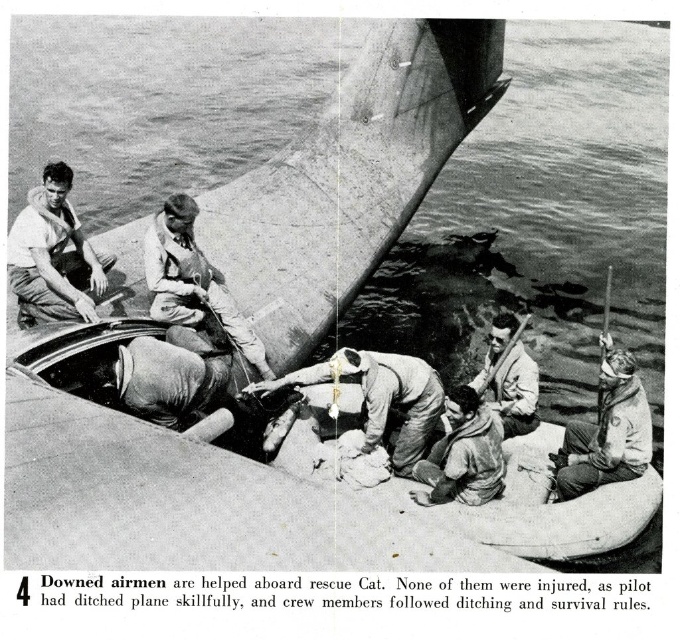
In the scene shown: You are a rescue worker on the ship deck and need to retrieve the white fabric life vest at center and the light gray fabric life vest at lower right. The ship has a robotic arm with a 2.5 meter reach. Can the robotic arm reach both life vests without moving its base?

The white fabric life vest at center is 2.53 meters from the light gray fabric life vest at lower right. Since the robotic arm has a 2.5 meter reach, it cannot reach both life vests without moving its base because the distance between them exceeds the arm reach.

You are a rescue coordinator on the ship deck. You need to direct a helicopter to pick up the light brown fabric sailor at center. The helicopter can only land if the landing zone is at least 15 meters away from any object. Is the landing zone on the ship deck safe?

The light brown fabric sailor at center is 13.68 meters away from the landing zone. Since 13.68 meters is less than the required 15 meters, the landing zone is not safe for the helicopter to land.

You are a photographer analyzing the image. You notice the light brown fabric sailor at center and the light gray fabric life vest at center. Which object is wider?

The light brown fabric sailor at center is wider than the light gray fabric life vest at center.